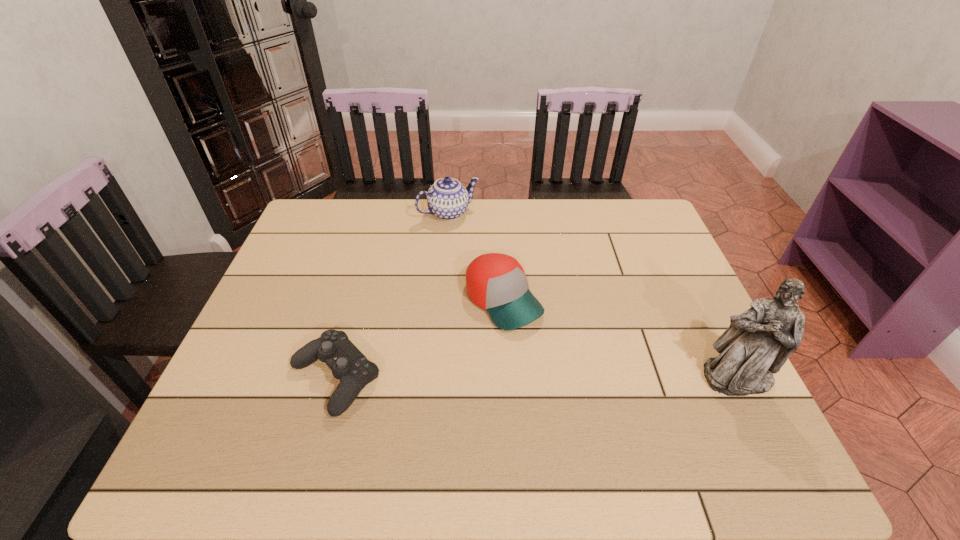
Identify the location of free space on the desktop that is between the leftmost object and the figurine and is positioned at the brim of the baseball cap. The height and width of the screenshot is (540, 960). (575, 377).

You are a GUI agent. You are given a task and a screenshot of the screen. Output one action in this format:
    pyautogui.click(x=<x>, y=<y>)
    Task: Click on the free spot on the desktop that is between the leftmost object and the figurine and is positioned at the spout of the farthest object
    
    Given the screenshot: What is the action you would take?
    pyautogui.click(x=574, y=377)